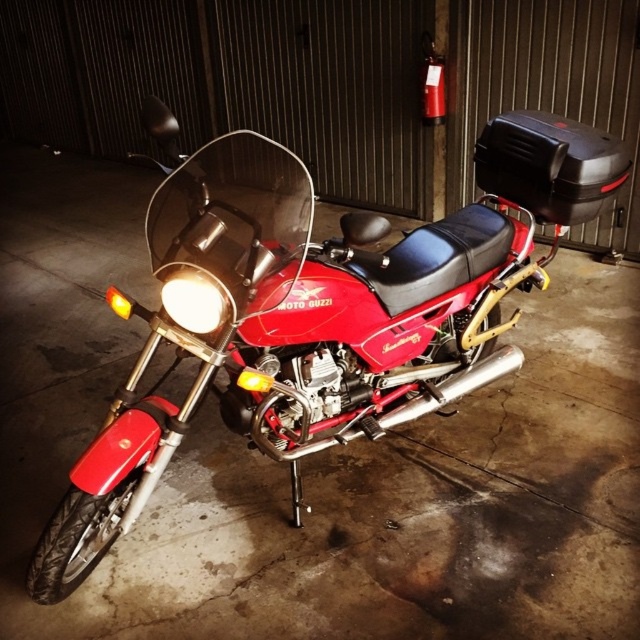
You are standing in front of the red Moto Guzzi motorcycle in the garage. There are two points marked on the motorcycle, one at coordinates point [131,432] and the other at point [205,330]. Which point is closer to your eyes?

Point [131,432] is further to the camera than point [205,330], so the point closer to your eyes is point [205,330].

You are a mechanic who needs to access the headlight of the shiny red motorcycle at center. Since the headlight is at matte white headlight at center, where should you stand relative to the motorcycle to reach it easily?

The shiny red motorcycle at center is located above the matte white headlight at center, so you should stand directly in front of the motorcycle to access the headlight easily.

You are a mechanic working in a garage. You need to move the shiny red motorcycle at center so you can access the matte white headlight at center for maintenance. Based on their positions, which direction should you move the motorcycle to get to the headlight?

The shiny red motorcycle at center is positioned on the right side of the matte white headlight at center, so you should move the motorcycle to the left to access the headlight.